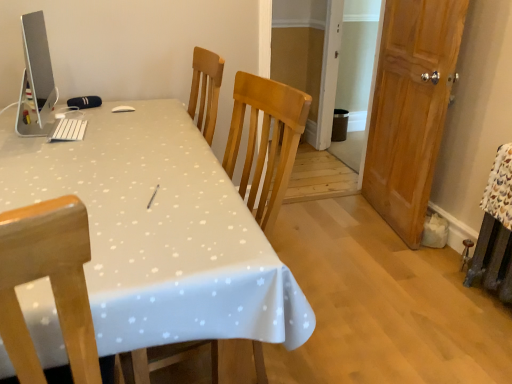
Locate an element on the screen. The image size is (512, 384). vacant area that is situated to the right of sleek silver monitor at upper left is located at coordinates (129, 131).